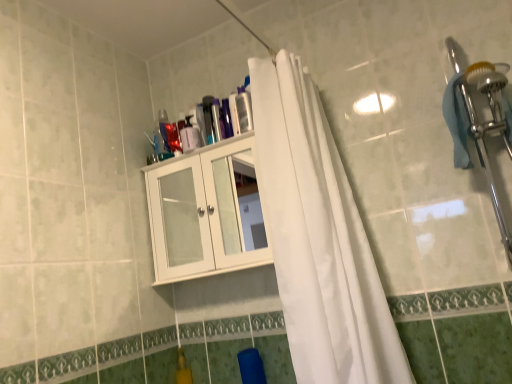
Where is `transparent plastic bottle at upper center`? transparent plastic bottle at upper center is located at coordinates (244, 109).

At what (x,y) coordinates should I click in order to perform the action: click on white fabric curtain at center. Please return your answer as a coordinate pair (x, y). Image resolution: width=512 pixels, height=384 pixels. Looking at the image, I should click on [318, 237].

This screenshot has width=512, height=384. In order to click on transparent plastic bottle at upper center in this screenshot , I will do `click(244, 109)`.

Can you tell me how much white glossy cabinet at upper center and transparent plastic bottle at upper center differ in facing direction?

There is a 0.571-degree angle between the facing directions of white glossy cabinet at upper center and transparent plastic bottle at upper center.

From the image's perspective, is white glossy cabinet at upper center positioned above or below transparent plastic bottle at upper center?

Clearly, from the image's perspective, white glossy cabinet at upper center is below transparent plastic bottle at upper center.

The width and height of the screenshot is (512, 384). Find the location of `cabinetry that is under the transparent plastic bottle at upper center (from a real-world perspective)`. cabinetry that is under the transparent plastic bottle at upper center (from a real-world perspective) is located at coordinates (201, 212).

Can you confirm if white glossy cabinet at upper center is wider than transparent plastic bottle at upper center?

Yes.

Based on the photo, does white fabric curtain at center have a lesser height compared to white glossy cabinet at upper center?

No.

From a real-world perspective, which object stands above the other?

white glossy cabinet at upper center, from a real-world perspective.

Considering the sizes of white fabric curtain at center and white glossy cabinet at upper center in the image, is white fabric curtain at center wider or thinner than white glossy cabinet at upper center?

Clearly, white fabric curtain at center has more width compared to white glossy cabinet at upper center.

Measure the distance between white fabric curtain at center and white glossy cabinet at upper center.

13.01 inches.

Is point (238, 259) farther from viewer compared to point (310, 198)?

Yes, point (238, 259) is behind point (310, 198).

Consider the image. How much distance is there between white glossy cabinet at upper center and white fabric curtain at center?

white glossy cabinet at upper center and white fabric curtain at center are 13.01 inches apart.

Is white glossy cabinet at upper center at the right side of white fabric curtain at center?

Incorrect, white glossy cabinet at upper center is not on the right side of white fabric curtain at center.

Locate an element on the screen. This screenshot has height=384, width=512. cabinetry lying behind the white fabric curtain at center is located at coordinates (201, 212).

Considering the sizes of objects transparent plastic bottle at upper center and white glossy cabinet at upper center in the image provided, who is shorter, transparent plastic bottle at upper center or white glossy cabinet at upper center?

transparent plastic bottle at upper center.

Is transparent plastic bottle at upper center far away from white glossy cabinet at upper center?

They are positioned close to each other.

From a real-world perspective, between transparent plastic bottle at upper center and white glossy cabinet at upper center, who is vertically lower?

white glossy cabinet at upper center is physically lower.

Considering the positions of objects transparent plastic bottle at upper center and white glossy cabinet at upper center in the image provided, who is more to the left, transparent plastic bottle at upper center or white glossy cabinet at upper center?

From the viewer's perspective, white glossy cabinet at upper center appears more on the left side.

Considering the points (321, 134) and (243, 119), which point is in front, point (321, 134) or point (243, 119)?

The point (321, 134) is in front.

Is white fabric curtain at center not near transparent plastic bottle at upper center?

They are positioned close to each other.

Could you tell me if white fabric curtain at center is turned towards transparent plastic bottle at upper center?

No.

How many degrees apart are the facing directions of white fabric curtain at center and transparent plastic bottle at upper center?

They differ by 2.95 degrees in their facing directions.

Based on the photo, in the image, is transparent plastic bottle at upper center positioned in front of or behind white fabric curtain at center?

Clearly, transparent plastic bottle at upper center is behind white fabric curtain at center.

Between transparent plastic bottle at upper center and white fabric curtain at center, which one appears on the left side from the viewer's perspective?

From the viewer's perspective, transparent plastic bottle at upper center appears more on the left side.

Is transparent plastic bottle at upper center facing towards white fabric curtain at center?

No.

I want to click on toiletry behind the white glossy cabinet at upper center, so coord(244,109).

At what (x,y) coordinates should I click in order to perform the action: click on curtain that is above the white glossy cabinet at upper center (from the image's perspective). Please return your answer as a coordinate pair (x, y). This screenshot has height=384, width=512. Looking at the image, I should click on (318, 237).

From the image, which object appears to be nearer to white fabric curtain at center, white glossy cabinet at upper center or transparent plastic bottle at upper center?

white glossy cabinet at upper center lies closer to white fabric curtain at center than the other object.

Estimate the real-world distances between objects in this image. Which object is closer to white fabric curtain at center, transparent plastic bottle at upper center or white glossy cabinet at upper center?

white glossy cabinet at upper center is closer to white fabric curtain at center.

When comparing their distances from transparent plastic bottle at upper center, does white fabric curtain at center or white glossy cabinet at upper center seem further?

white fabric curtain at center is positioned further to the anchor transparent plastic bottle at upper center.

Estimate the real-world distances between objects in this image. Which object is further from white glossy cabinet at upper center, transparent plastic bottle at upper center or white fabric curtain at center?

transparent plastic bottle at upper center is further to white glossy cabinet at upper center.

Looking at the image, which one is located closer to white glossy cabinet at upper center, white fabric curtain at center or transparent plastic bottle at upper center?

white fabric curtain at center is closer to white glossy cabinet at upper center.

Looking at the image, which one is located closer to transparent plastic bottle at upper center, white glossy cabinet at upper center or white fabric curtain at center?

The object closer to transparent plastic bottle at upper center is white glossy cabinet at upper center.

At what (x,y) coordinates should I click in order to perform the action: click on cabinetry between white fabric curtain at center and transparent plastic bottle at upper center in the front-back direction. Please return your answer as a coordinate pair (x, y). The height and width of the screenshot is (384, 512). Looking at the image, I should click on (201, 212).